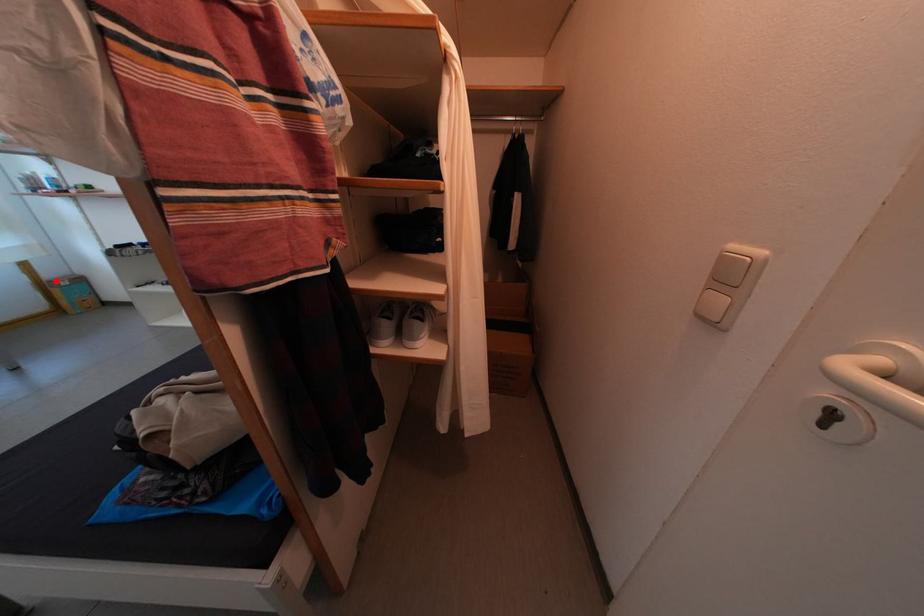
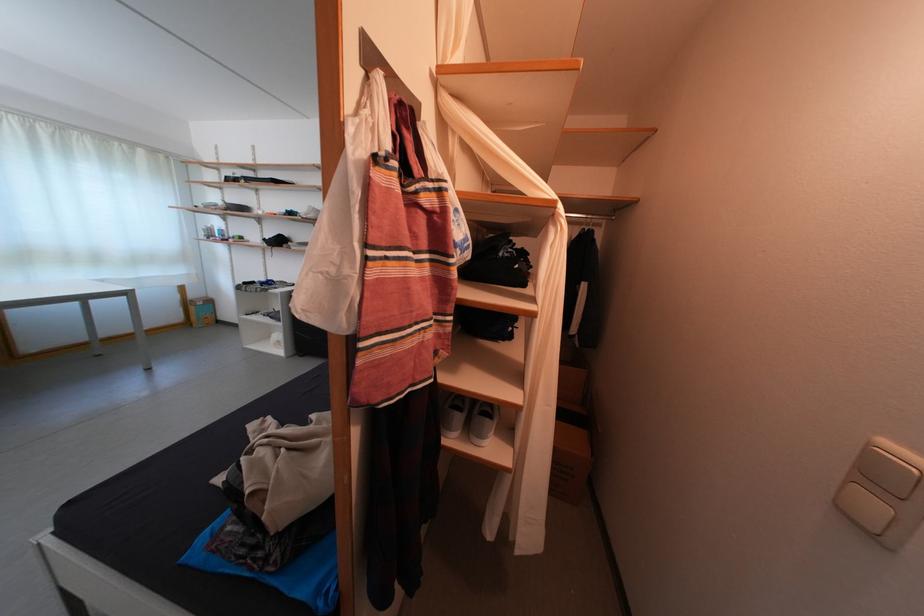
In the second image, find the point that corresponds to the highlighted location in the first image.

(201, 302)